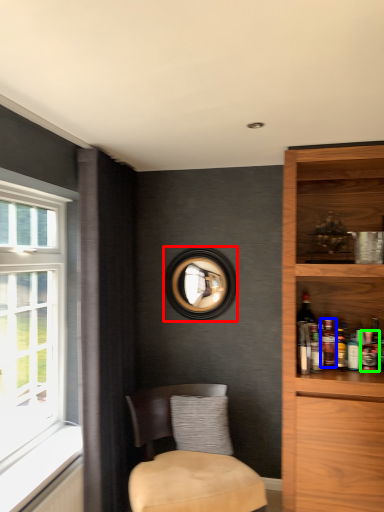
Question: Which object is the farthest from picture frame (highlighted by a red box)? Choose among these: beverage (highlighted by a blue box) or beverage (highlighted by a green box).

Choices:
 (A) beverage
 (B) beverage

Answer: (B)